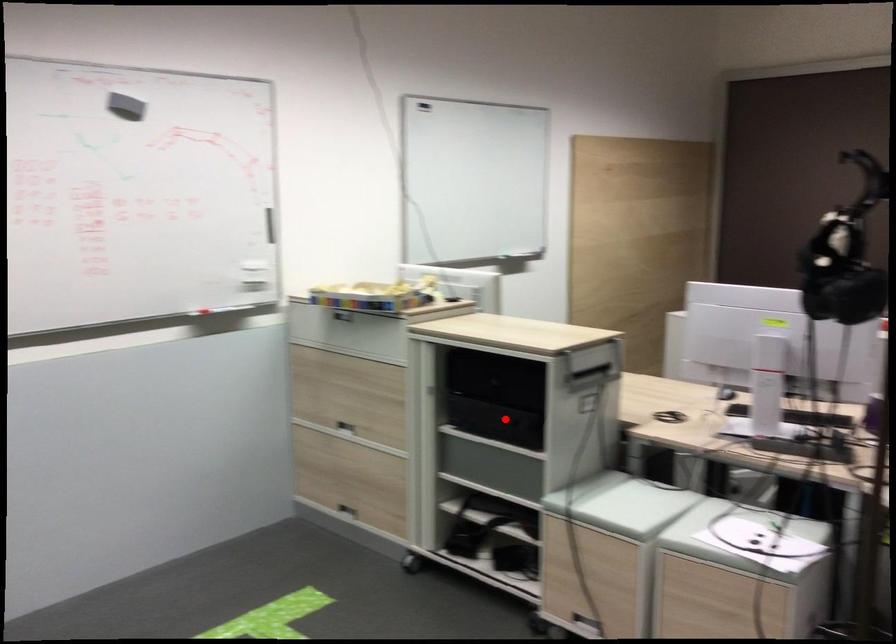
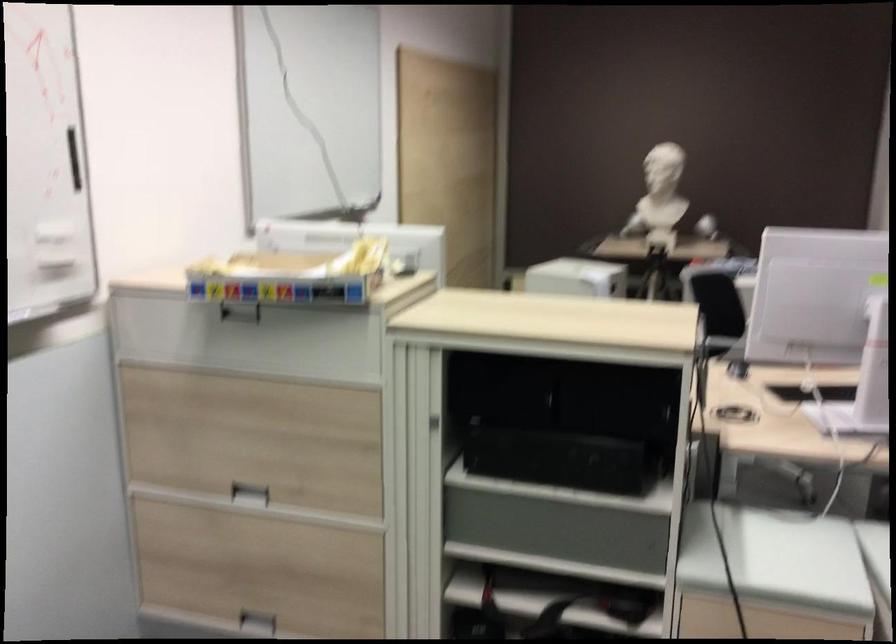
The point at the highlighted location is marked in the first image. Where is the corresponding point in the second image?

(597, 459)